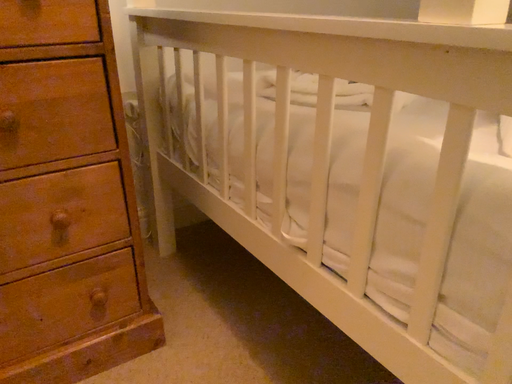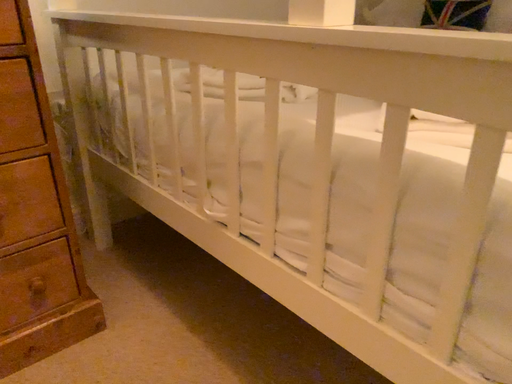
Question: Which way did the camera rotate in the video?

Choices:
 (A) rotated right
 (B) rotated left

Answer: (A)